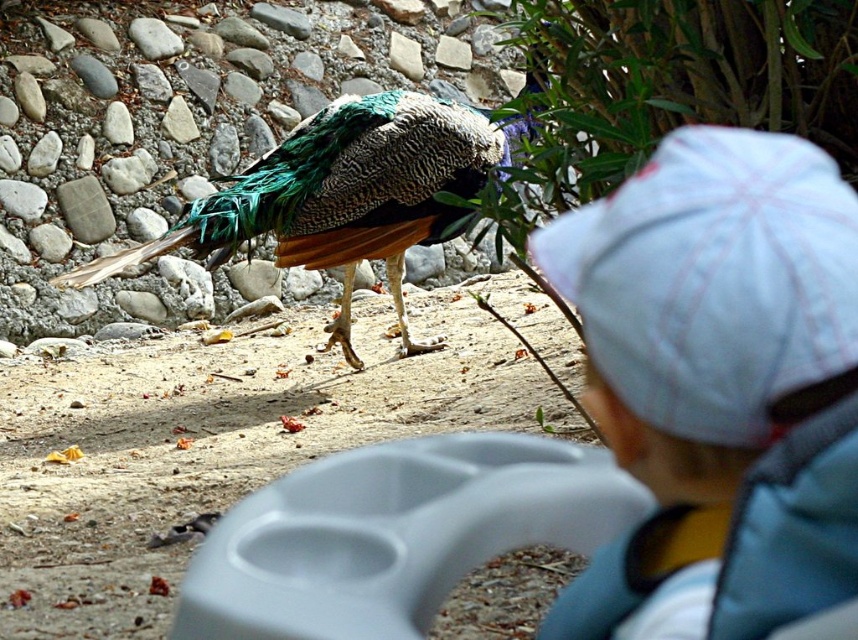
You are a photographer trying to capture the shiny green peacock at center and the white cotton hat at upper right in the same frame. Which object will appear larger in your photo?

The shiny green peacock at center will appear larger in the photo because it is larger than the white cotton hat at upper right.

You are a photographer trying to capture the shiny green peacock at center and the white cotton hat at upper right in the same frame. Which object is narrower in width?

The white cotton hat at upper right has a lesser width compared to the shiny green peacock at center, so the white cotton hat at upper right is narrower in width.